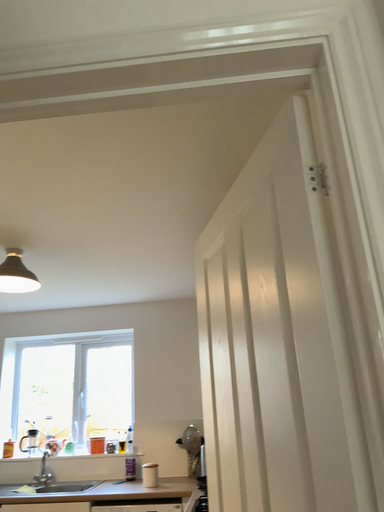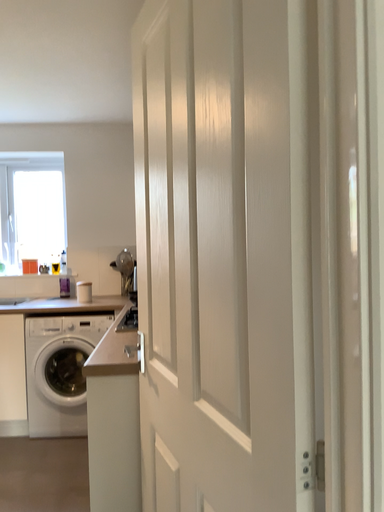
Question: Which way did the camera rotate in the video?

Choices:
 (A) rotated downward
 (B) rotated upward

Answer: (A)